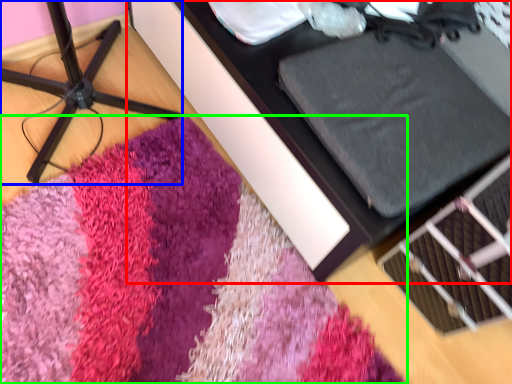
Question: Based on their relative distances, which object is nearer to furniture (highlighted by a red box)? Choose from furniture (highlighted by a blue box) and mat (highlighted by a green box).

Choices:
 (A) furniture
 (B) mat

Answer: (B)